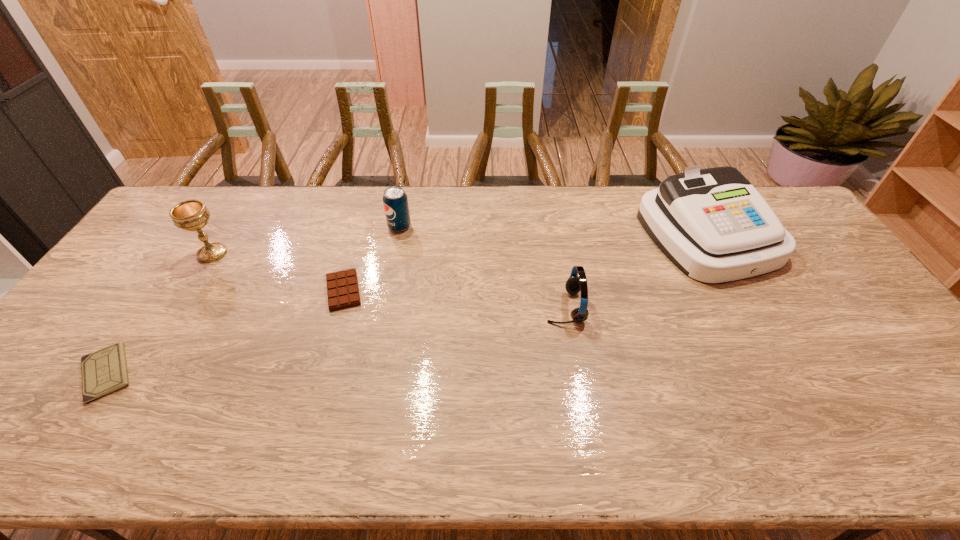
Where is `vacant point located between the fifth tallest object and the rightmost object`? The image size is (960, 540). vacant point located between the fifth tallest object and the rightmost object is located at coordinates (525, 263).

Find the location of a particular element. The height and width of the screenshot is (540, 960). unoccupied position between the third object from left to right and the rightmost object is located at coordinates (525, 263).

At what (x,y) coordinates should I click in order to perform the action: click on vacant point located between the candy bar and the fourth object from left to right. Please return your answer as a coordinate pair (x, y). This screenshot has height=540, width=960. Looking at the image, I should click on (372, 259).

I want to click on vacant region between the rightmost object and the chalice, so click(x=460, y=245).

The width and height of the screenshot is (960, 540). What are the coordinates of `free spot between the second object from right to left and the second shortest object` in the screenshot? It's located at (454, 299).

Find the location of `unoccupied position between the rightmost object and the soda can`. unoccupied position between the rightmost object and the soda can is located at coordinates (554, 231).

Where is `object that ranks as the second closest to the cash register`? object that ranks as the second closest to the cash register is located at coordinates (395, 201).

Where is `the third closest object to the fourth object from left to right`? This screenshot has width=960, height=540. the third closest object to the fourth object from left to right is located at coordinates (191, 215).

Find the location of `free space that satisfies the following two spatial constraints: 1. on the back side of the chalice; 2. on the left side of the soda can`. free space that satisfies the following two spatial constraints: 1. on the back side of the chalice; 2. on the left side of the soda can is located at coordinates (229, 227).

Image resolution: width=960 pixels, height=540 pixels. I want to click on free space that satisfies the following two spatial constraints: 1. on the front side of the chalice; 2. on the right side of the candy bar, so click(190, 291).